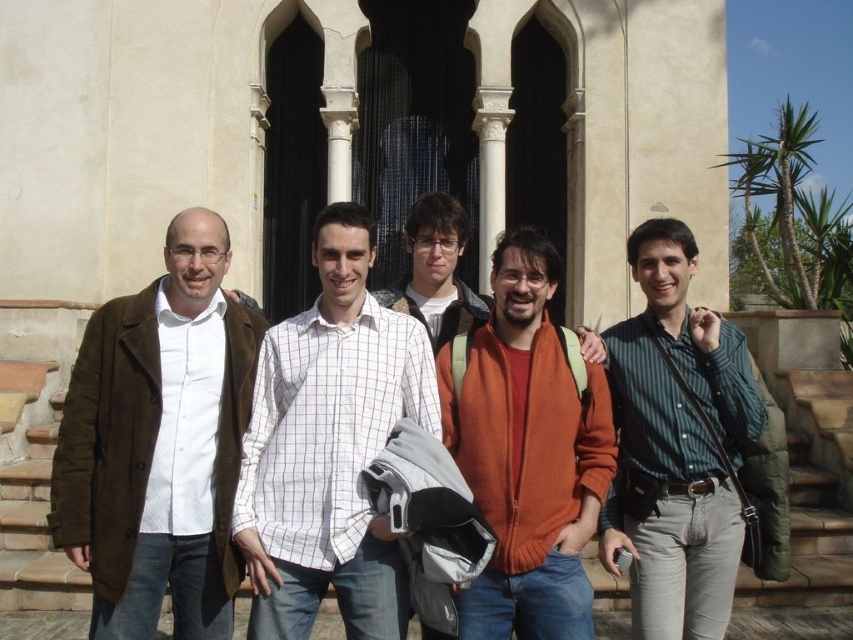
Question: Is brown suede coat at left wider than white checkered shirt at center?

Choices:
 (A) yes
 (B) no

Answer: (B)

Question: Which point is farther to the camera?

Choices:
 (A) orange fleece jacket at center
 (B) brown stone stairs at lower left

Answer: (B)

Question: Which point appears closest to the camera in this image?

Choices:
 (A) (521, 448)
 (B) (167, 470)

Answer: (B)

Question: Is white checkered shirt at center wider than brown stone stairs at lower left?

Choices:
 (A) no
 (B) yes

Answer: (A)

Question: Can you confirm if white checkered shirt at center is smaller than green striped shirt at center?

Choices:
 (A) yes
 (B) no

Answer: (A)

Question: Which object is farther from the camera taking this photo?

Choices:
 (A) brown stone stairs at lower left
 (B) white checkered shirt at center

Answer: (A)